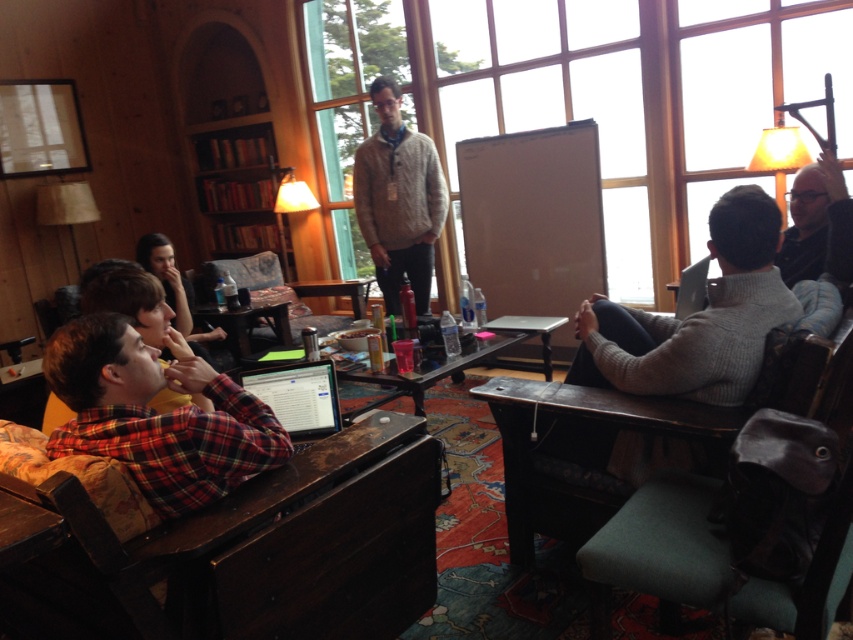
Between point (119, 444) and point (254, 301), which one is positioned behind?

The point (254, 301) is behind.

Can you confirm if red plaid shirt at lower left is positioned above wooden table at center?

No.

Locate an element on the screen. red plaid shirt at lower left is located at coordinates (155, 416).

Can you confirm if metallic silver table at center is shorter than smooth wooden table at center?

In fact, metallic silver table at center may be taller than smooth wooden table at center.

Does metallic silver table at center appear over smooth wooden table at center?

No.

Describe the element at coordinates (439, 365) in the screenshot. I see `metallic silver table at center` at that location.

The width and height of the screenshot is (853, 640). In order to click on metallic silver table at center in this screenshot , I will do `click(439, 365)`.

Can you confirm if gray fabric armchair at right is wider than velvet floral-patterned armchair at center?

Incorrect, gray fabric armchair at right's width does not surpass velvet floral-patterned armchair at center's.

Between gray fabric armchair at right and velvet floral-patterned armchair at center, which one appears on the left side from the viewer's perspective?

velvet floral-patterned armchair at center

In order to click on gray fabric armchair at right in this screenshot , I will do `click(595, 456)`.

Find the location of a particular element. This screenshot has width=853, height=640. gray fabric armchair at right is located at coordinates (595, 456).